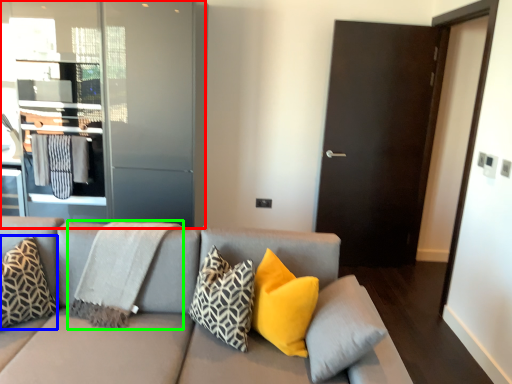
Question: Which is farther away from elevator (highlighted by a red box)? pillow (highlighted by a blue box) or blanket (highlighted by a green box)?

Choices:
 (A) pillow
 (B) blanket

Answer: (A)